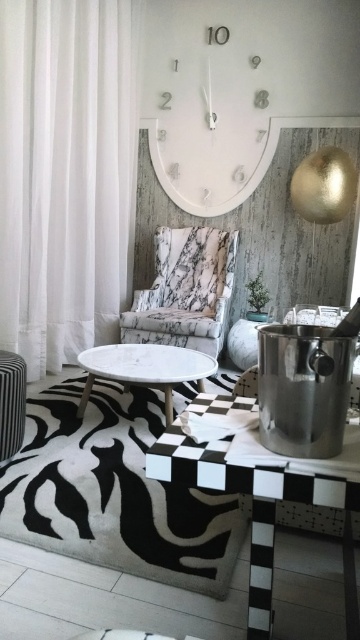
Does white marble side table at center appear on the right side of black striped stool at lower left?

Correct, you'll find white marble side table at center to the right of black striped stool at lower left.

Is white marble side table at center bigger than black striped stool at lower left?

Indeed, white marble side table at center has a larger size compared to black striped stool at lower left.

Between point (114, 372) and point (10, 358), which one is positioned behind?

The point (114, 372) is behind.

Where is `white marble side table at center`? The height and width of the screenshot is (640, 360). white marble side table at center is located at coordinates coord(145,369).

Can you confirm if white sheer curtain at left is positioned to the right of white glossy clock at upper center?

In fact, white sheer curtain at left is to the left of white glossy clock at upper center.

Is point (6, 310) positioned before point (181, 128)?

Yes, point (6, 310) is in front of point (181, 128).

Who is more forward, (x=0, y=22) or (x=163, y=108)?

Point (x=0, y=22)

At what (x,y) coordinates should I click in order to perform the action: click on white sheer curtain at left. Please return your answer as a coordinate pair (x, y). Looking at the image, I should click on (65, 172).

Is marble-patterned armchair at center positioned behind white marble side table at center?

Yes, marble-patterned armchair at center is behind white marble side table at center.

Which is in front, point (205, 314) or point (176, 365)?

Positioned in front is point (176, 365).

Describe the element at coordinates (185, 291) in the screenshot. The image size is (360, 640). I see `marble-patterned armchair at center` at that location.

The height and width of the screenshot is (640, 360). What are the coordinates of `marble-patterned armchair at center` in the screenshot? It's located at (185, 291).